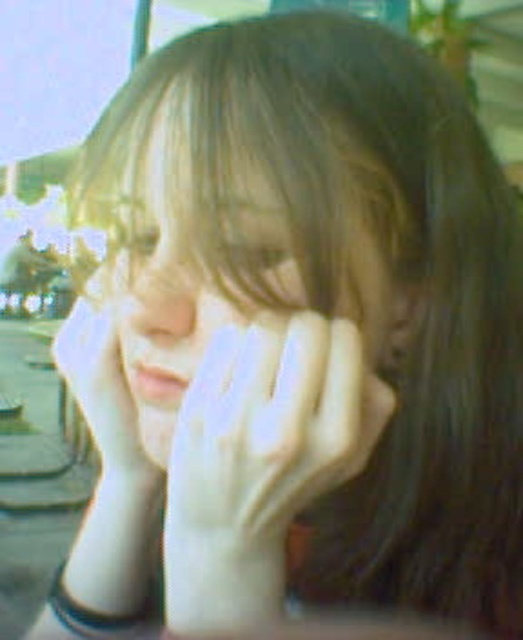
Is white matte glove at center closer to the viewer compared to smooth skin face at center?

Yes, white matte glove at center is closer to the viewer.

Can you confirm if white matte glove at center is positioned to the right of smooth skin face at center?

Indeed, white matte glove at center is positioned on the right side of smooth skin face at center.

Is point (170, 572) behind point (130, 365)?

No, it is not.

You are a GUI agent. You are given a task and a screenshot of the screen. Output one action in this format:
    pyautogui.click(x=<x>, y=<y>)
    Task: Click on the white matte glove at center
    
    Given the screenshot: What is the action you would take?
    pyautogui.click(x=259, y=461)

Which of these two, smooth skin face at center or smooth skin nose at center, stands shorter?

smooth skin nose at center is shorter.

Is smooth skin face at center smaller than smooth skin nose at center?

No.

Find the location of a particular element. Image resolution: width=523 pixels, height=640 pixels. smooth skin face at center is located at coordinates (197, 296).

Does point (328, 321) lie in front of point (149, 280)?

No, it is behind (149, 280).

Does white matte glove at center have a greater width compared to smooth skin nose at center?

Yes, white matte glove at center is wider than smooth skin nose at center.

Where is `white matte glove at center`? The width and height of the screenshot is (523, 640). white matte glove at center is located at coordinates (259, 461).

Where is `white matte glove at center`? The height and width of the screenshot is (640, 523). white matte glove at center is located at coordinates (259, 461).